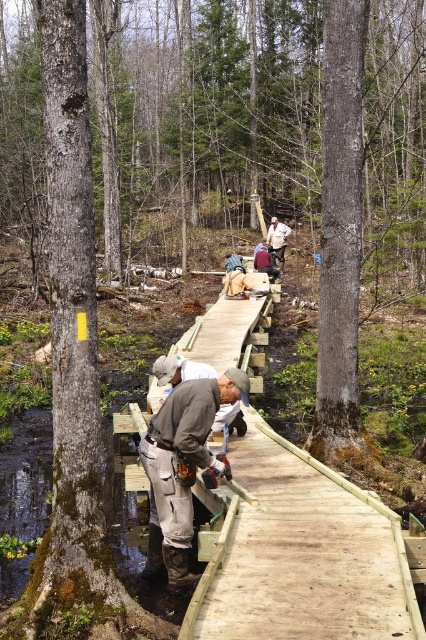
Does point (340, 64) come behind point (154, 442)?

Yes, point (340, 64) is behind point (154, 442).

Find the location of a particular element. The height and width of the screenshot is (640, 426). smooth gray bark at center is located at coordinates (340, 240).

You are a GUI agent. You are given a task and a screenshot of the screen. Output one action in this format:
    pyautogui.click(x=<x>, y=<y>)
    Task: Click on the smooth gray bark at center
    
    Given the screenshot: What is the action you would take?
    pyautogui.click(x=340, y=240)

Does smooth gray bark at center have a greater height compared to khaki fabric pants at center?

Yes, smooth gray bark at center is taller than khaki fabric pants at center.

Is smooth gray bark at center wider than khaki fabric pants at center?

Incorrect, smooth gray bark at center's width does not surpass khaki fabric pants at center's.

Measure the distance between point (325,417) and camera.

The distance of point (325,417) from camera is 7.14 meters.

The image size is (426, 640). Identify the location of smooth gray bark at center. (340, 240).

Between smooth gray bark at center and white cotton shirt at upper center, which one has more height?

With more height is white cotton shirt at upper center.

Does smooth gray bark at center have a lesser height compared to white cotton shirt at upper center?

Indeed, smooth gray bark at center has a lesser height compared to white cotton shirt at upper center.

Locate an element on the screen. The width and height of the screenshot is (426, 640). smooth gray bark at center is located at coordinates (340, 240).